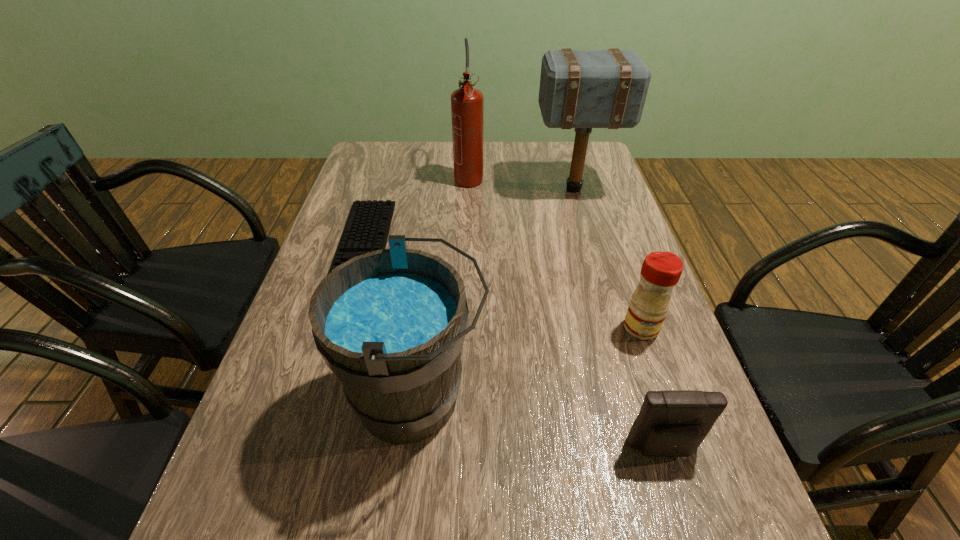
Identify the location of vacant region located 0.270m on the striking surface of the mallet. click(447, 189).

The image size is (960, 540). I want to click on free space located 0.280m on the striking surface of the mallet, so click(444, 189).

At what (x,y) coordinates should I click in order to perform the action: click on vacant region located 0.050m with a handle on the side of the third tallest object. Please return your answer as a coordinate pair (x, y). Looking at the image, I should click on (514, 398).

Identify the location of free point located 0.320m on the front of the condiment. The image size is (960, 540). (700, 498).

Find the location of `blank space located 0.050m with an open flap on the pouch`. blank space located 0.050m with an open flap on the pouch is located at coordinates (678, 494).

At what (x,y) coordinates should I click in order to perform the action: click on vacant space located 0.300m on the front of the shortest object. Please return your answer as a coordinate pair (x, y). This screenshot has width=960, height=540. Looking at the image, I should click on (316, 404).

I want to click on fire extinguisher that is at the far edge, so click(467, 103).

The image size is (960, 540). Identify the location of mallet present at the far edge. (583, 89).

Locate an element on the screen. This screenshot has width=960, height=540. object located in the left edge section of the desktop is located at coordinates [367, 228].

Locate an element on the screen. Image resolution: width=960 pixels, height=540 pixels. mallet that is at the right edge is located at coordinates (583, 89).